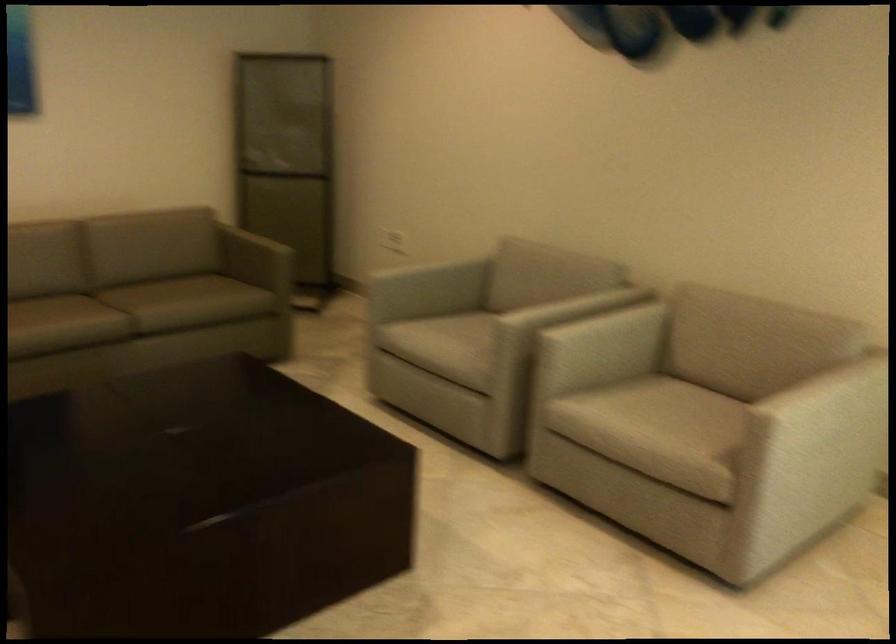
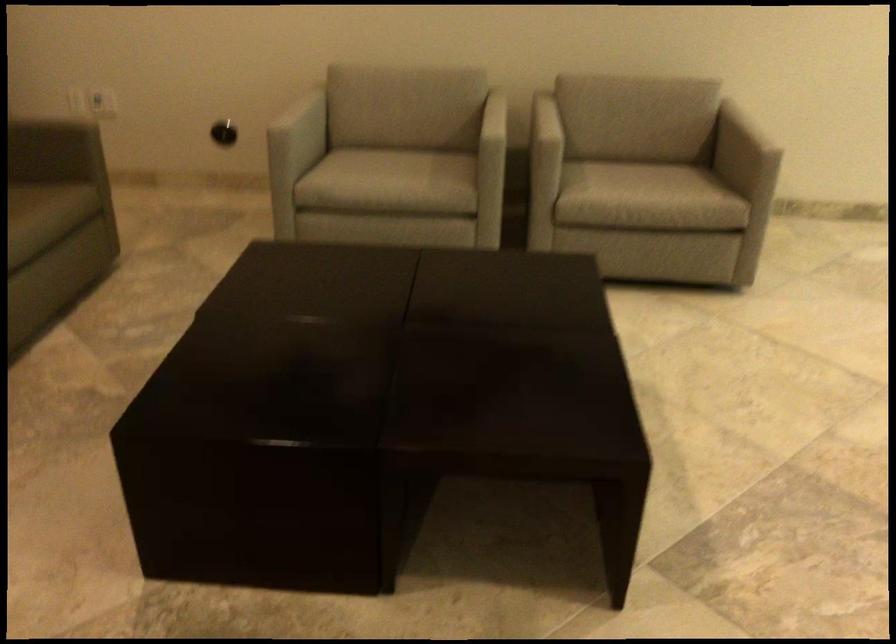
The point at (486,339) is marked in the first image. Where is the corresponding point in the second image?

(492, 151)